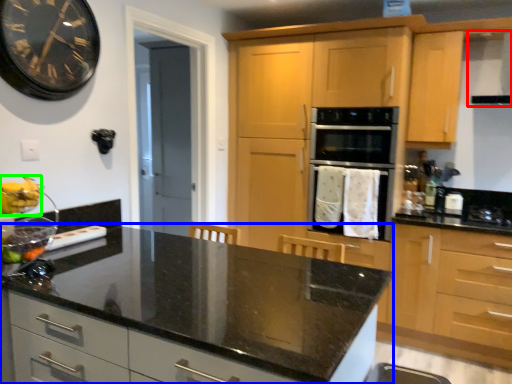
Question: Estimate the real-world distances between objects in this image. Which object is farther from exhaust hood (highlighted by a red box), countertop (highlighted by a blue box) or banana (highlighted by a green box)?

Choices:
 (A) countertop
 (B) banana

Answer: (B)